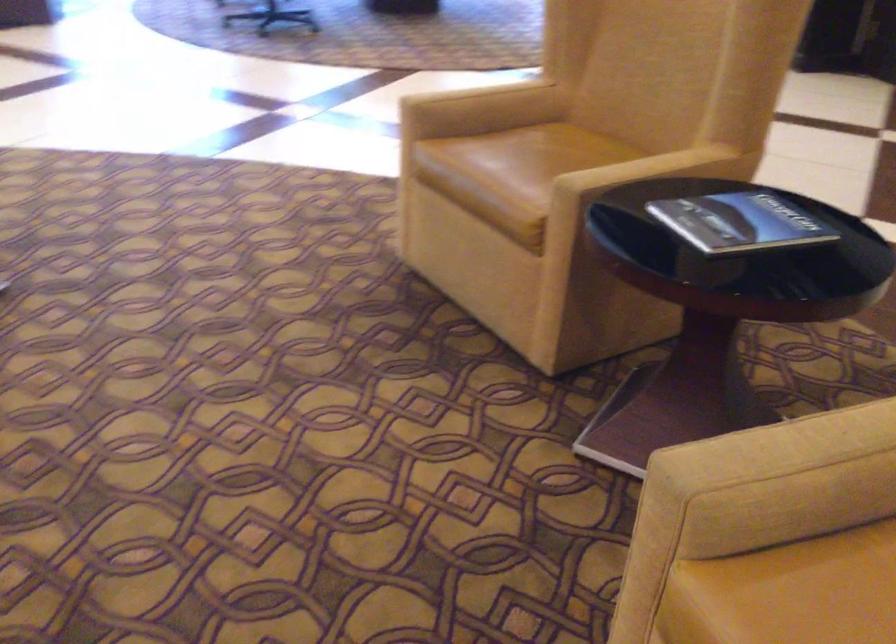
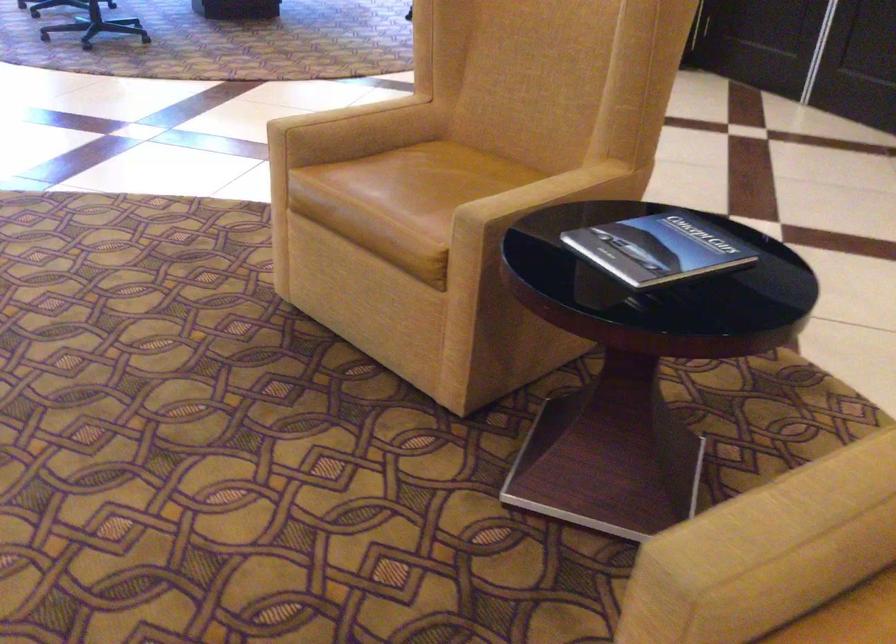
Locate, in the second image, the point that corresponds to the point at 641,167 in the first image.

(541, 193)